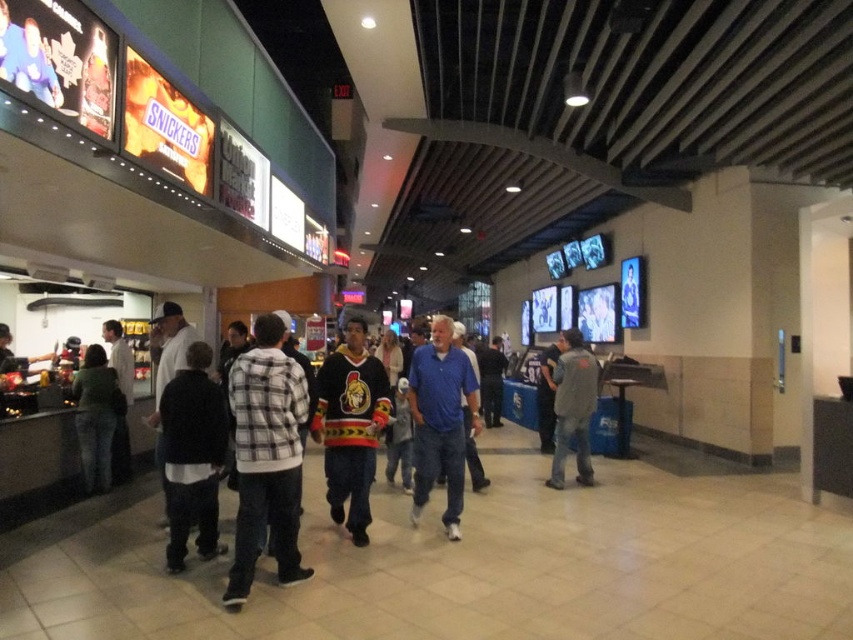
Question: Is black fleece jacket at center smaller than denim jacket at center?

Choices:
 (A) no
 (B) yes

Answer: (A)

Question: Which object appears closest to the camera in this image?

Choices:
 (A) blue cotton shirt at center
 (B) plaid fabric shirt at center
 (C) green cotton hoodie at center

Answer: (B)

Question: Which object appears farthest from the camera in this image?

Choices:
 (A) black fleece jacket at center
 (B) black jersey at center
 (C) denim jacket at center

Answer: (C)

Question: Based on their relative distances, which object is nearer to the black jersey at center?

Choices:
 (A) blue cotton shirt at center
 (B) black fleece jacket at center

Answer: (A)

Question: In this image, where is blue cotton shirt at center located relative to green cotton hoodie at center?

Choices:
 (A) left
 (B) right

Answer: (B)

Question: Is black jersey at center further to the viewer compared to blue cotton shirt at center?

Choices:
 (A) no
 (B) yes

Answer: (A)